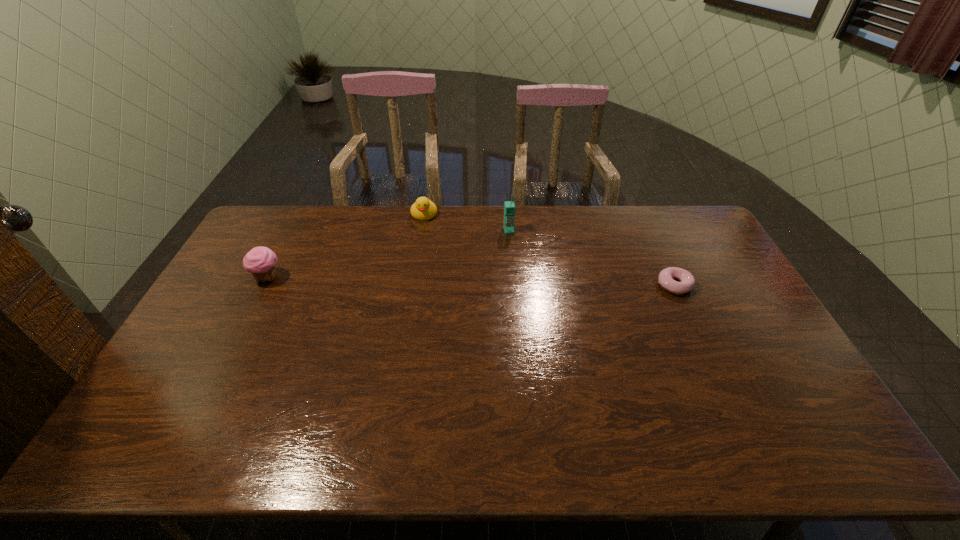
Find the location of `vacant space that's between the duckling and the leftmost object`. vacant space that's between the duckling and the leftmost object is located at coordinates (346, 246).

Where is `vacant region between the rightmost object and the duckling`? vacant region between the rightmost object and the duckling is located at coordinates (549, 249).

Image resolution: width=960 pixels, height=540 pixels. I want to click on blank region between the shortest object and the third object from right to left, so click(x=549, y=249).

Locate an element on the screen. The image size is (960, 540). free space that is in between the cupcake and the second shortest object is located at coordinates (346, 246).

You are a GUI agent. You are given a task and a screenshot of the screen. Output one action in this format:
    pyautogui.click(x=<x>, y=<y>)
    Task: Click on the unoccupied position between the tallest object and the second shortest object
    The image size is (960, 540).
    Given the screenshot: What is the action you would take?
    pyautogui.click(x=467, y=222)

The image size is (960, 540). I want to click on the closest object relative to the second tallest object, so click(x=423, y=209).

Identify the location of the closest object to the farthest object. This screenshot has height=540, width=960. (509, 207).

Where is `free space that satisfies the following two spatial constraints: 1. on the front side of the leftmost object; 2. on the right side of the rightmost object`? The image size is (960, 540). free space that satisfies the following two spatial constraints: 1. on the front side of the leftmost object; 2. on the right side of the rightmost object is located at coordinates (263, 285).

The image size is (960, 540). Identify the location of blank area in the image that satisfies the following two spatial constraints: 1. on the front side of the doughnut; 2. on the right side of the farthest object. (413, 285).